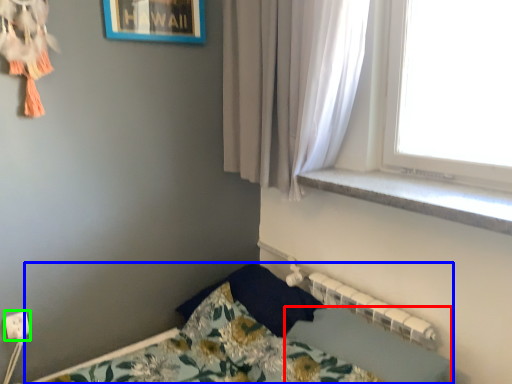
Question: Based on their relative distances, which object is nearer to sheet (highlighted by a red box)? Choose from bed (highlighted by a blue box) and electric outlet (highlighted by a green box).

Choices:
 (A) bed
 (B) electric outlet

Answer: (A)